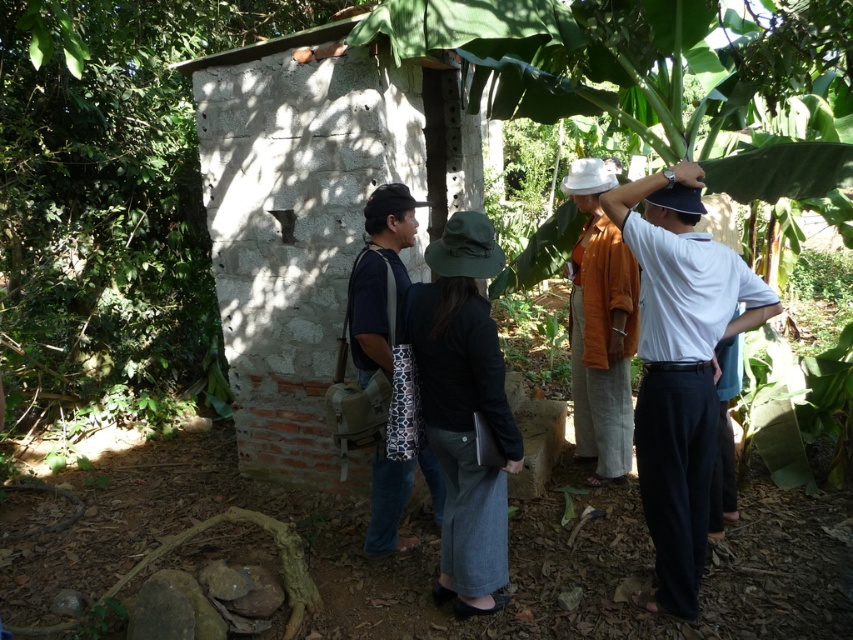
Question: Which object is positioned closest to the white matte shirt at center?

Choices:
 (A) dark blue jeans at center
 (B) orange cotton shirt at center
 (C) denim skirt at center

Answer: (C)

Question: Considering the real-world distances, which object is closest to the orange cotton shirt at center?

Choices:
 (A) dark blue jeans at center
 (B) denim skirt at center

Answer: (B)

Question: Can you confirm if white matte shirt at center is thinner than orange cotton shirt at center?

Choices:
 (A) no
 (B) yes

Answer: (A)

Question: Which point is farther from the camera taking this photo?

Choices:
 (A) (453, 385)
 (B) (698, 456)

Answer: (B)

Question: Does white matte shirt at center have a smaller size compared to orange cotton shirt at center?

Choices:
 (A) yes
 (B) no

Answer: (B)

Question: Is white matte shirt at center above denim skirt at center?

Choices:
 (A) yes
 (B) no

Answer: (A)